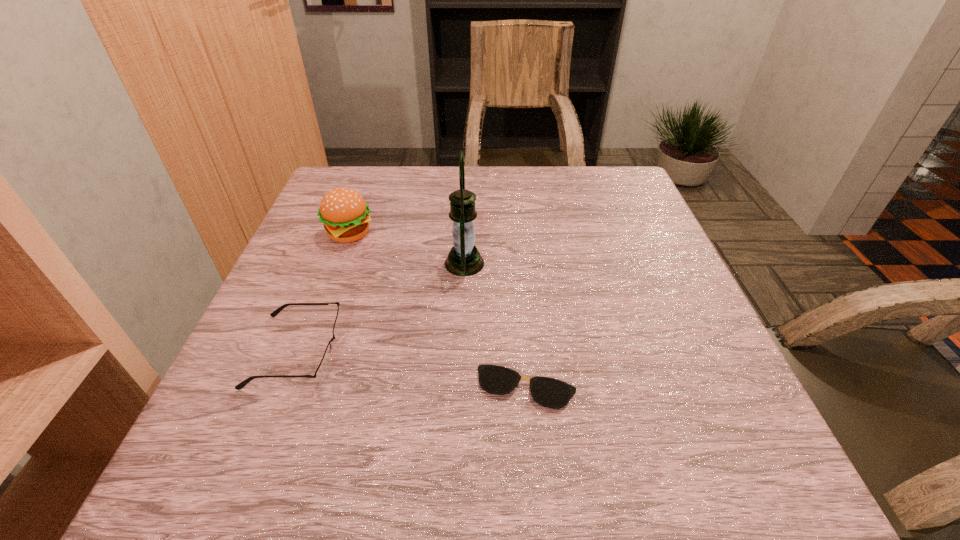
Where is `object that is the second closest to the shorter spectacles`? This screenshot has height=540, width=960. object that is the second closest to the shorter spectacles is located at coordinates (324, 366).

At what (x,y) coordinates should I click in order to perform the action: click on free space that satisfies the following two spatial constraints: 1. on the front-facing side of the right spectacles; 2. on the right side of the third tallest object. Please return your answer as a coordinate pair (x, y). This screenshot has width=960, height=540. Looking at the image, I should click on (282, 388).

At what (x,y) coordinates should I click in order to perform the action: click on free space that satisfies the following two spatial constraints: 1. on the back side of the shortest object; 2. on the front-facing side of the third tallest object. Please return your answer as a coordinate pair (x, y). Looking at the image, I should click on (523, 351).

Identify the location of free space that satisfies the following two spatial constraints: 1. on the side where the tallest object emits light; 2. on the right side of the shortest object. (459, 388).

I want to click on free space in the image that satisfies the following two spatial constraints: 1. on the front side of the third shortest object; 2. on the front-facing side of the left spectacles, so click(x=305, y=351).

At what (x,y) coordinates should I click in order to perform the action: click on free spot that satisfies the following two spatial constraints: 1. on the back side of the shortest object; 2. on the side where the tallest object emits light. Please return your answer as a coordinate pair (x, y). This screenshot has width=960, height=540. Looking at the image, I should click on (516, 264).